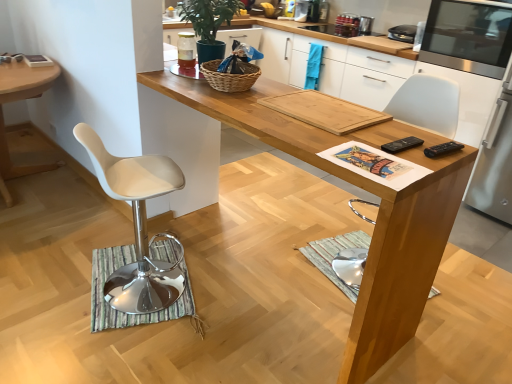
Question: Is woven brown basket at center shorter than stainless steel microwave at right, the 1th appliance when ordered from right to left?

Choices:
 (A) yes
 (B) no

Answer: (A)

Question: Does woven brown basket at center contain stainless steel microwave at right, arranged as the 4th appliance when viewed from the left?

Choices:
 (A) no
 (B) yes

Answer: (A)

Question: Can you confirm if woven brown basket at center is thinner than stainless steel microwave at right, the 1th appliance when ordered from right to left?

Choices:
 (A) no
 (B) yes

Answer: (B)

Question: Can you confirm if woven brown basket at center is wider than stainless steel microwave at right, arranged as the 4th appliance when viewed from the left?

Choices:
 (A) no
 (B) yes

Answer: (A)

Question: Are woven brown basket at center and stainless steel microwave at right, the 1th appliance when ordered from right to left, making contact?

Choices:
 (A) no
 (B) yes

Answer: (A)

Question: Can you confirm if woven brown basket at center is smaller than stainless steel microwave at right, the 1th appliance when ordered from right to left?

Choices:
 (A) yes
 (B) no

Answer: (A)

Question: From the image's perspective, is green matte plant at upper center below stainless steel microwave at right, the 1th appliance when ordered from right to left?

Choices:
 (A) yes
 (B) no

Answer: (A)

Question: From the image's perspective, does green matte plant at upper center appear higher than stainless steel microwave at right, arranged as the 4th appliance when viewed from the left?

Choices:
 (A) yes
 (B) no

Answer: (B)

Question: Considering the relative sizes of green matte plant at upper center and stainless steel microwave at right, the 1th appliance when ordered from right to left, in the image provided, is green matte plant at upper center wider than stainless steel microwave at right, the 1th appliance when ordered from right to left,?

Choices:
 (A) yes
 (B) no

Answer: (B)

Question: Can you see green matte plant at upper center touching stainless steel microwave at right, the 1th appliance when ordered from right to left?

Choices:
 (A) yes
 (B) no

Answer: (B)

Question: From a real-world perspective, is green matte plant at upper center physically above stainless steel microwave at right, arranged as the 4th appliance when viewed from the left?

Choices:
 (A) no
 (B) yes

Answer: (B)

Question: Is green matte plant at upper center bigger than stainless steel microwave at right, arranged as the 4th appliance when viewed from the left?

Choices:
 (A) no
 (B) yes

Answer: (A)

Question: Is woven brown basket at center oriented towards metallic silver toaster at upper center, placed as the third appliance when sorted from right to left?

Choices:
 (A) no
 (B) yes

Answer: (B)